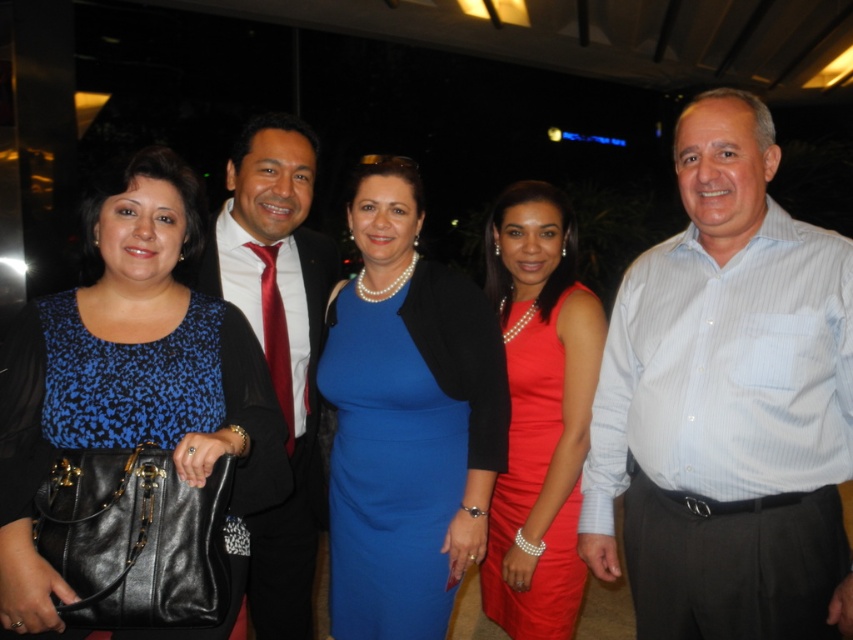
Question: Does white striped shirt at center appear on the right side of royal blue satin dress at center?

Choices:
 (A) no
 (B) yes

Answer: (B)

Question: Among these points, which one is nearest to the camera?

Choices:
 (A) (575, 486)
 (B) (248, 358)
 (C) (403, 518)
 (D) (300, 152)

Answer: (B)

Question: Can you confirm if white striped shirt at center is thinner than blue printed blouse at center?

Choices:
 (A) yes
 (B) no

Answer: (A)

Question: Among these objects, which one is farthest from the camera?

Choices:
 (A) blue printed blouse at center
 (B) shiny red dress at center
 (C) shiny red tie at center
 (D) royal blue satin dress at center

Answer: (D)

Question: Which of the following is the farthest from the observer?

Choices:
 (A) (573, 515)
 (B) (245, 148)

Answer: (B)

Question: Where is white striped shirt at center located in relation to shiny red dress at center in the image?

Choices:
 (A) left
 (B) right

Answer: (B)